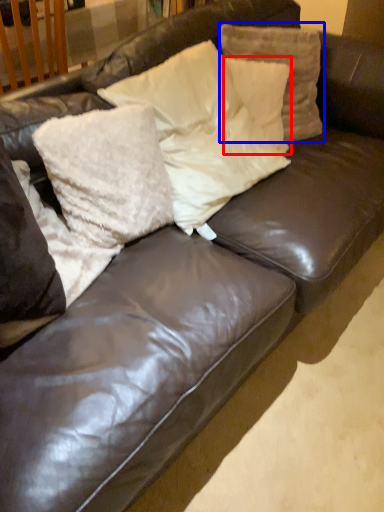
Question: Which object is further to the camera taking this photo, pillow (highlighted by a red box) or pillow (highlighted by a blue box)?

Choices:
 (A) pillow
 (B) pillow

Answer: (A)